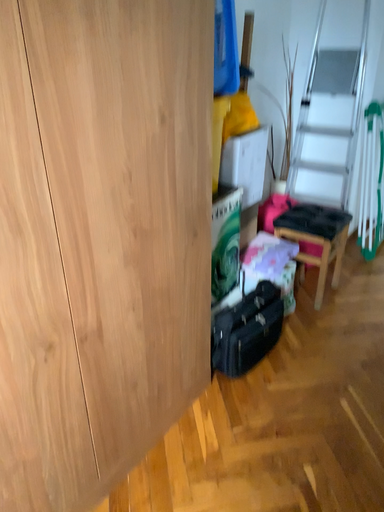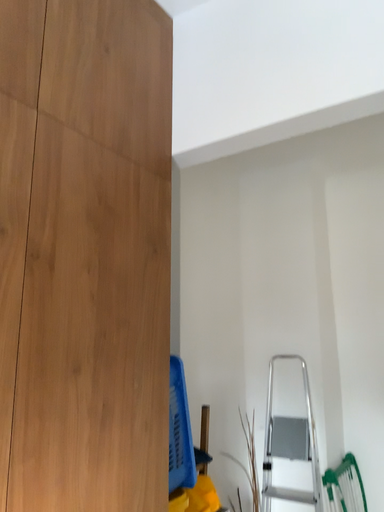
Question: How did the camera likely rotate when shooting the video?

Choices:
 (A) rotated upward
 (B) rotated downward

Answer: (A)